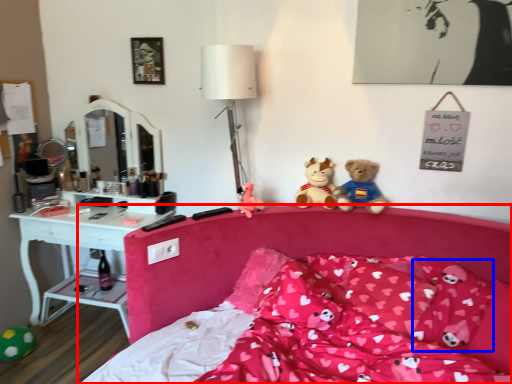
Question: Among these objects, which one is nearest to the camera, bed (highlighted by a red box) or pillow (highlighted by a blue box)?

Choices:
 (A) bed
 (B) pillow

Answer: (A)